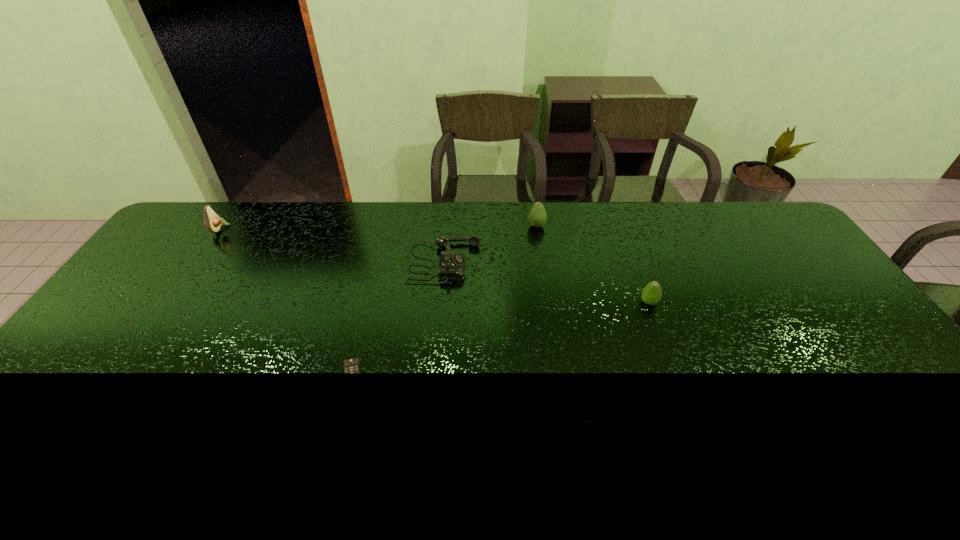
Image resolution: width=960 pixels, height=540 pixels. I want to click on vacant area at the near left corner, so click(64, 461).

At what (x,y) coordinates should I click in order to perform the action: click on free space at the far right corner. Please return your answer as a coordinate pair (x, y). Looking at the image, I should click on (779, 232).

Where is `blank area at the near right corner`? blank area at the near right corner is located at coordinates [x=940, y=447].

This screenshot has height=540, width=960. Find the location of `empty space that is in between the third farthest object and the rightmost object`. empty space that is in between the third farthest object and the rightmost object is located at coordinates (546, 282).

Locate an element on the screen. The width and height of the screenshot is (960, 540). free spot between the third object from left to right and the fourth farthest object is located at coordinates (546, 282).

At what (x,y) coordinates should I click in order to perform the action: click on unoccupied area between the rightmost avocado and the second object from right to left. Please return your answer as a coordinate pair (x, y). Image resolution: width=960 pixels, height=540 pixels. Looking at the image, I should click on (592, 264).

Where is `vacant space that's between the tallest object and the second avocado from left to right`? The height and width of the screenshot is (540, 960). vacant space that's between the tallest object and the second avocado from left to right is located at coordinates (378, 227).

Locate an element on the screen. The width and height of the screenshot is (960, 540). free space that is in between the second object from right to left and the second nearest object is located at coordinates (592, 264).

Image resolution: width=960 pixels, height=540 pixels. In order to click on free space between the fourth object from left to right and the third object from right to left in this screenshot , I will do `click(491, 244)`.

Where is `free point between the leftmost object and the second avocado from left to right`? free point between the leftmost object and the second avocado from left to right is located at coordinates 378,227.